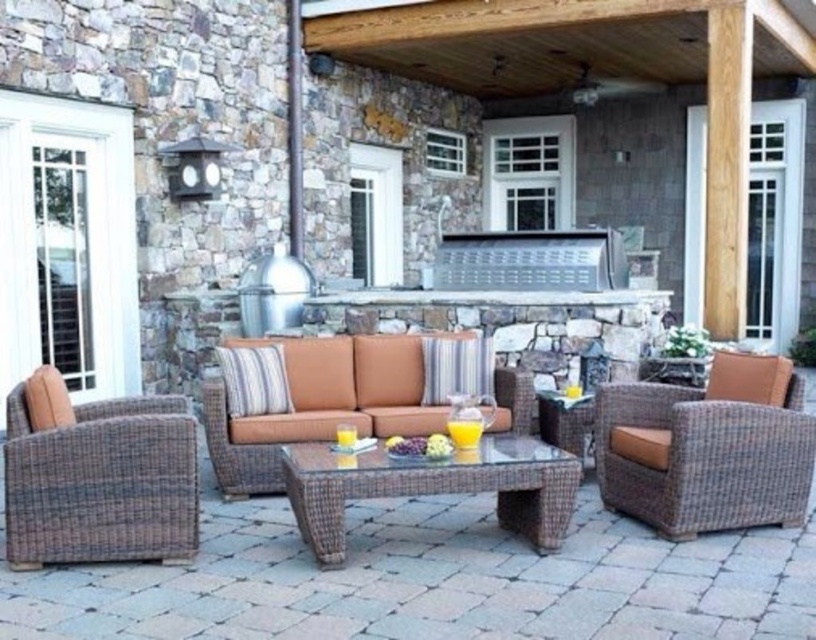
Between brown wicker armchair at right and brown wicker coffee table at center, which one appears on the right side from the viewer's perspective?

From the viewer's perspective, brown wicker armchair at right appears more on the right side.

Between brown wicker armchair at right and brown wicker coffee table at center, which one appears on the left side from the viewer's perspective?

From the viewer's perspective, brown wicker coffee table at center appears more on the left side.

What do you see at coordinates (708, 449) in the screenshot? I see `brown wicker armchair at right` at bounding box center [708, 449].

Find the location of a particular element. brown wicker armchair at right is located at coordinates pyautogui.click(x=708, y=449).

Is brown wicker armchair at center taller than brown wicker coffee table at center?

Indeed, brown wicker armchair at center has a greater height compared to brown wicker coffee table at center.

Is brown wicker armchair at center positioned behind brown wicker coffee table at center?

Yes, it is.

Where is `brown wicker armchair at center`? Image resolution: width=816 pixels, height=640 pixels. brown wicker armchair at center is located at coordinates (318, 404).

Find the location of a particular element. This screenshot has height=640, width=816. brown wicker armchair at center is located at coordinates (318, 404).

Does brown wicker armchair at right appear under brown wicker armchair at center?

Yes.

Which is below, brown wicker armchair at right or brown wicker armchair at center?

brown wicker armchair at right is lower down.

Who is more distant from viewer, (x=755, y=419) or (x=313, y=406)?

The point (x=313, y=406) is more distant.

At what (x,y) coordinates should I click in order to perform the action: click on brown wicker armchair at right. Please return your answer as a coordinate pair (x, y). This screenshot has height=640, width=816. Looking at the image, I should click on (708, 449).